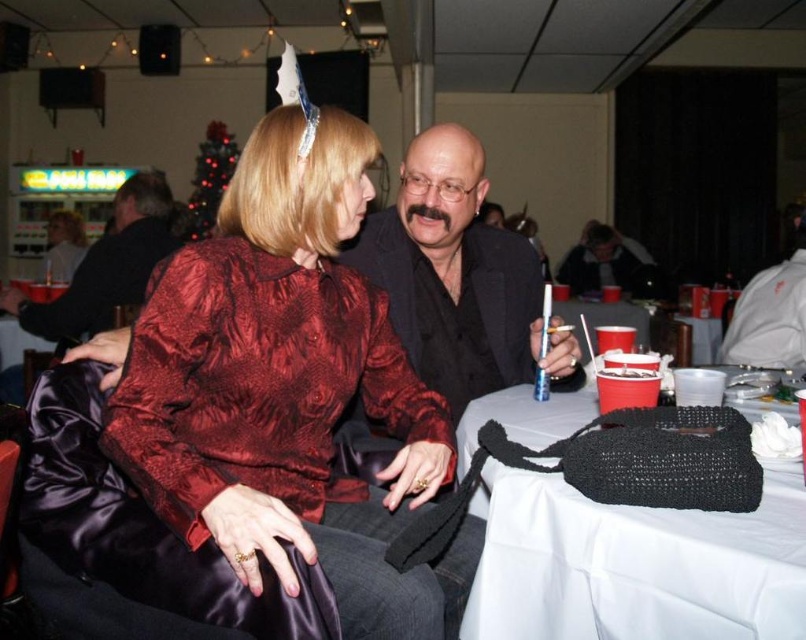
You are at a party and need to store your items in a narrow compartment. You have a black knitted bag at lower right and a matte black jacket at center. Which item can fit into the compartment more easily?

The black knitted bag at lower right is thinner than the matte black jacket at center, so it can fit into the narrow compartment more easily.